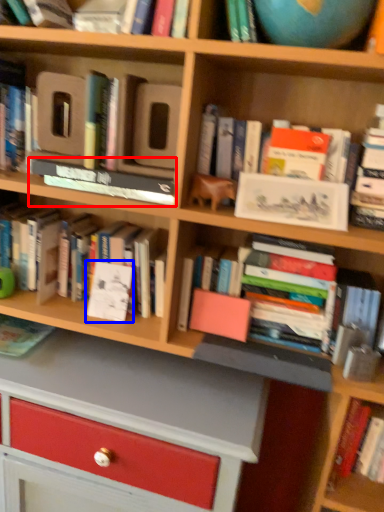
Question: Which object is further to the camera taking this photo, book (highlighted by a red box) or paperback book (highlighted by a blue box)?

Choices:
 (A) book
 (B) paperback book

Answer: (B)